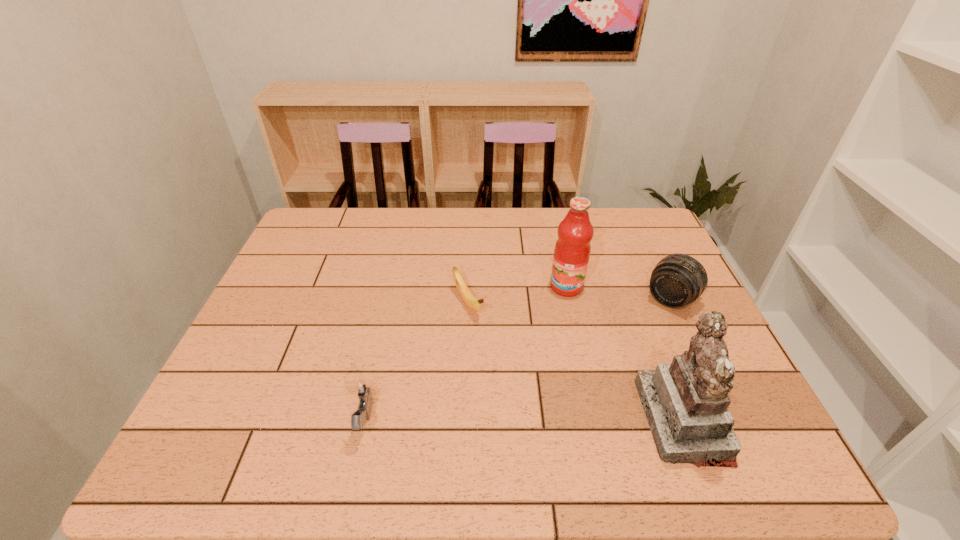
I want to click on free location located on the front-facing side of the figurine, so click(594, 420).

Find the location of a particular element. vacant area located at the front element of the third shortest object is located at coordinates (614, 368).

Where is `vacant space situated 0.380m at the front element of the third shortest object`? The image size is (960, 540). vacant space situated 0.380m at the front element of the third shortest object is located at coordinates (583, 407).

Identify the location of free region located at the front element of the third shortest object. (588, 401).

Identify the location of vacant space situated 0.190m at the stem of the shortest object. (512, 374).

Locate an element on the screen. blank space located 0.310m at the stem of the shortest object is located at coordinates (540, 415).

Identify the location of vacant region located at the stem of the shortest object. The width and height of the screenshot is (960, 540). (505, 365).

Where is `vacant space located 0.150m on the front label of the third object from left to right`? vacant space located 0.150m on the front label of the third object from left to right is located at coordinates (549, 336).

At what (x,y) coordinates should I click in order to perform the action: click on free location located on the front label of the third object from left to right. Please return your answer as a coordinate pair (x, y). Looking at the image, I should click on (540, 359).

Locate an element on the screen. Image resolution: width=960 pixels, height=540 pixels. vacant space positioned 0.300m on the front label of the third object from left to right is located at coordinates (533, 382).